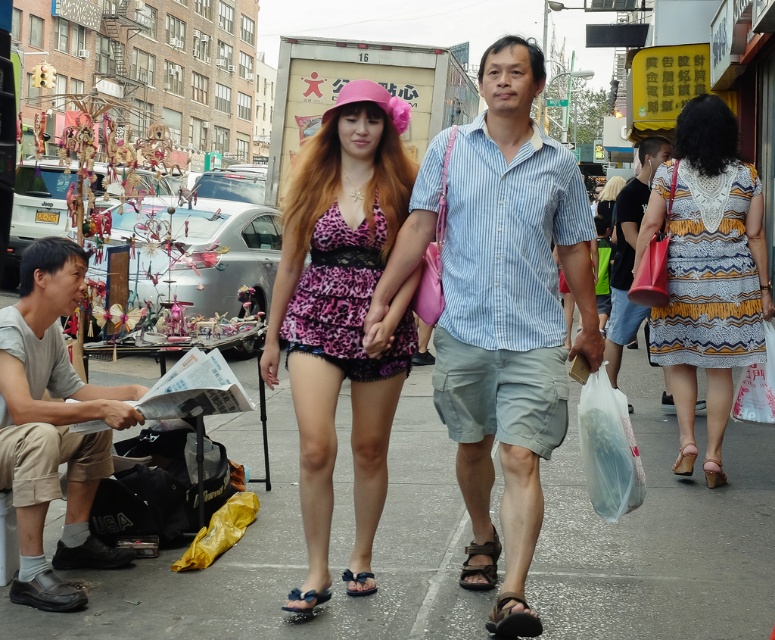
Looking at this image, between leopard print fabric dress at center and printed fabric dress at center, which one is positioned lower?

leopard print fabric dress at center

Between leopard print fabric dress at center and printed fabric dress at center, which one has less height?

With less height is printed fabric dress at center.

You are a GUI agent. You are given a task and a screenshot of the screen. Output one action in this format:
    pyautogui.click(x=<x>, y=<y>)
    Task: Click on the leopard print fabric dress at center
    The width and height of the screenshot is (775, 640).
    Given the screenshot: What is the action you would take?
    pyautogui.click(x=343, y=307)

Identify the location of leopard print fabric dress at center. The image size is (775, 640). (343, 307).

Is point (124, 616) more distant than point (370, 588)?

No.

Is gray concrete pavement at center taller than black suede sandal at center?

Incorrect, gray concrete pavement at center's height is not larger of black suede sandal at center's.

The height and width of the screenshot is (640, 775). What do you see at coordinates (302, 552) in the screenshot? I see `gray concrete pavement at center` at bounding box center [302, 552].

You are a GUI agent. You are given a task and a screenshot of the screen. Output one action in this format:
    pyautogui.click(x=<x>, y=<y>)
    Task: Click on the gray concrete pavement at center
    This screenshot has height=640, width=775.
    Given the screenshot: What is the action you would take?
    pyautogui.click(x=302, y=552)

The width and height of the screenshot is (775, 640). Describe the element at coordinates (512, 618) in the screenshot. I see `black leather sandal at lower center` at that location.

How much distance is there between black leather sandal at lower center and brown leather sandal at lower center?

A distance of 24.97 inches exists between black leather sandal at lower center and brown leather sandal at lower center.

Who is more forward, (527, 612) or (491, 573)?

Positioned in front is point (527, 612).

The width and height of the screenshot is (775, 640). Identify the location of black leather sandal at lower center. (512, 618).